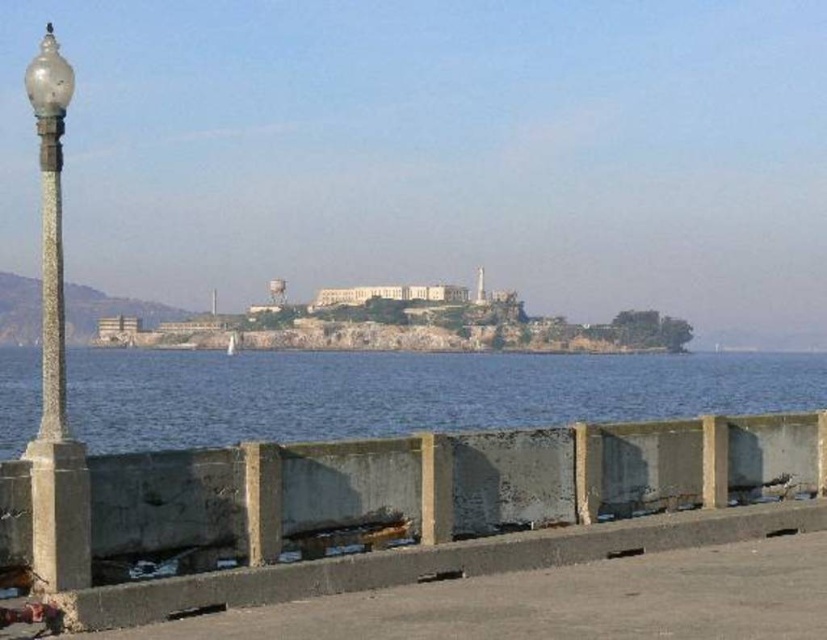
Question: Can you confirm if blue water at lower center is bigger than concrete at lower center?

Choices:
 (A) yes
 (B) no

Answer: (A)

Question: Based on their relative distances, which object is farther from the matte glass lamp post at left?

Choices:
 (A) blue water at lower center
 (B) concrete at lower center

Answer: (A)

Question: Is concrete at lower center closer to camera compared to matte glass lamp post at left?

Choices:
 (A) yes
 (B) no

Answer: (B)

Question: Which object appears farthest from the camera in this image?

Choices:
 (A) matte glass lamp post at left
 (B) blue water at lower center

Answer: (B)

Question: Considering the relative positions of blue water at lower center and concrete at lower center in the image provided, where is blue water at lower center located with respect to concrete at lower center?

Choices:
 (A) left
 (B) right

Answer: (B)

Question: Among these points, which one is farthest from the camera?

Choices:
 (A) (330, 605)
 (B) (53, 70)
 (C) (178, 412)

Answer: (C)